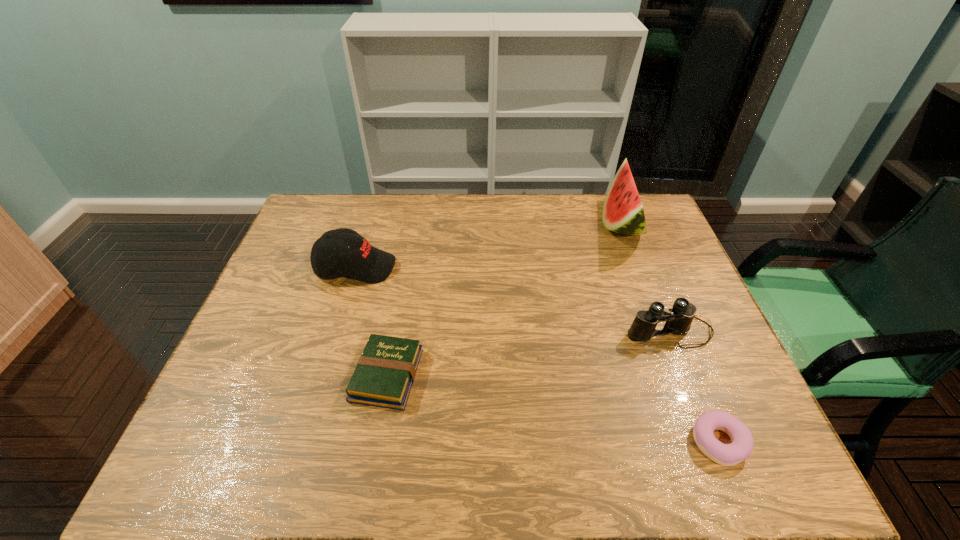
Where is `vacant space that satisfies the following two spatial constraints: 1. on the front-facing side of the baseball cap; 2. on the right side of the binoculars`? vacant space that satisfies the following two spatial constraints: 1. on the front-facing side of the baseball cap; 2. on the right side of the binoculars is located at coordinates (337, 331).

At what (x,y) coordinates should I click in order to perform the action: click on vacant area that satisfies the following two spatial constraints: 1. on the outer rind of the binoculars; 2. on the right side of the tallest object. Please return your answer as a coordinate pair (x, y). Looking at the image, I should click on (661, 331).

What are the coordinates of `vacant space that satisfies the following two spatial constraints: 1. on the outer rind of the watermelon; 2. on the left side of the pastry` in the screenshot? It's located at (703, 442).

Find the location of a particular element. vacant space that satisfies the following two spatial constraints: 1. on the outer rind of the tallest object; 2. on the back side of the binoculars is located at coordinates (661, 331).

Locate an element on the screen. vacant space that satisfies the following two spatial constraints: 1. on the front side of the binoculars; 2. on the right side of the pastry is located at coordinates (713, 442).